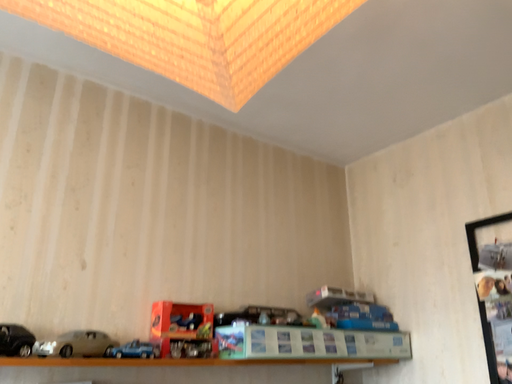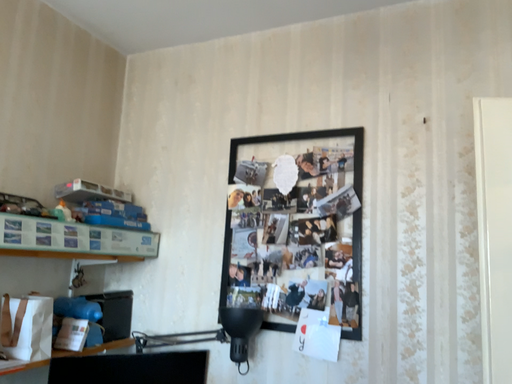
Question: How did the camera likely rotate when shooting the video?

Choices:
 (A) rotated downward
 (B) rotated upward

Answer: (A)